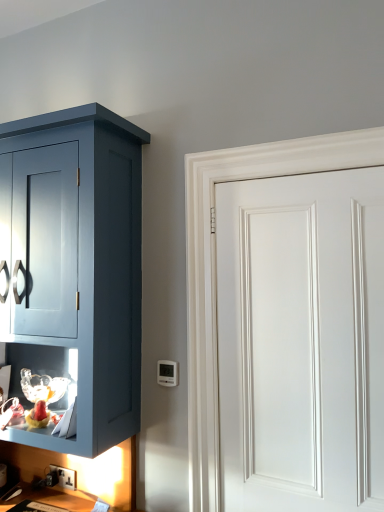
Question: From a real-world perspective, relative to white plastic thermostat at lower center, is white smooth door at right vertically above or below?

Choices:
 (A) below
 (B) above

Answer: (B)

Question: Considering the positions of white smooth door at right and white plastic thermostat at lower center in the image, is white smooth door at right wider or thinner than white plastic thermostat at lower center?

Choices:
 (A) thin
 (B) wide

Answer: (B)

Question: Estimate the real-world distances between objects in this image. Which object is farther from the white plastic thermostat at lower center?

Choices:
 (A) black plastic electric outlet at lower left
 (B) white smooth door at right

Answer: (A)

Question: Which object is the farthest from the black plastic electric outlet at lower left?

Choices:
 (A) white smooth door at right
 (B) white plastic thermostat at lower center

Answer: (A)